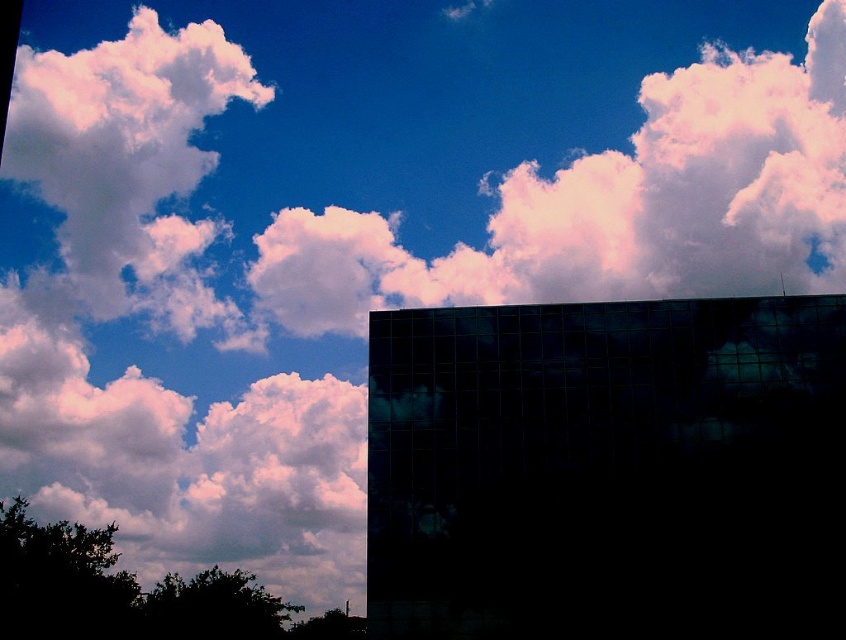
You are a GUI agent. You are given a task and a screenshot of the screen. Output one action in this format:
    pyautogui.click(x=<x>, y=<y>)
    Task: Click on the white fluffy cloud at upper center
    The height and width of the screenshot is (640, 846).
    Given the screenshot: What is the action you would take?
    pyautogui.click(x=614, y=205)

At what (x,y) coordinates should I click in order to perform the action: click on white fluffy cloud at upper center. Please return your answer as a coordinate pair (x, y). Image resolution: width=846 pixels, height=640 pixels. Looking at the image, I should click on (614, 205).

Find the location of `white fluffy cloud at upper center`. white fluffy cloud at upper center is located at coordinates (614, 205).